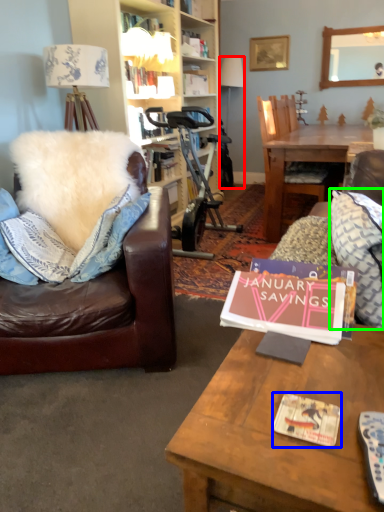
Question: Which object is positioned farthest from lamp (highlighted by a red box)? Select from magazine (highlighted by a blue box) and pillow (highlighted by a green box).

Choices:
 (A) magazine
 (B) pillow

Answer: (A)